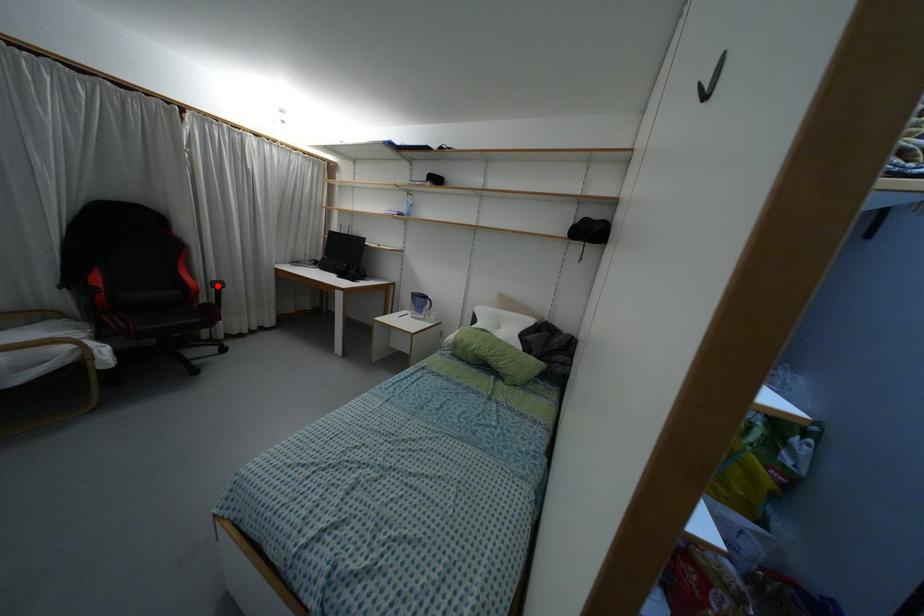
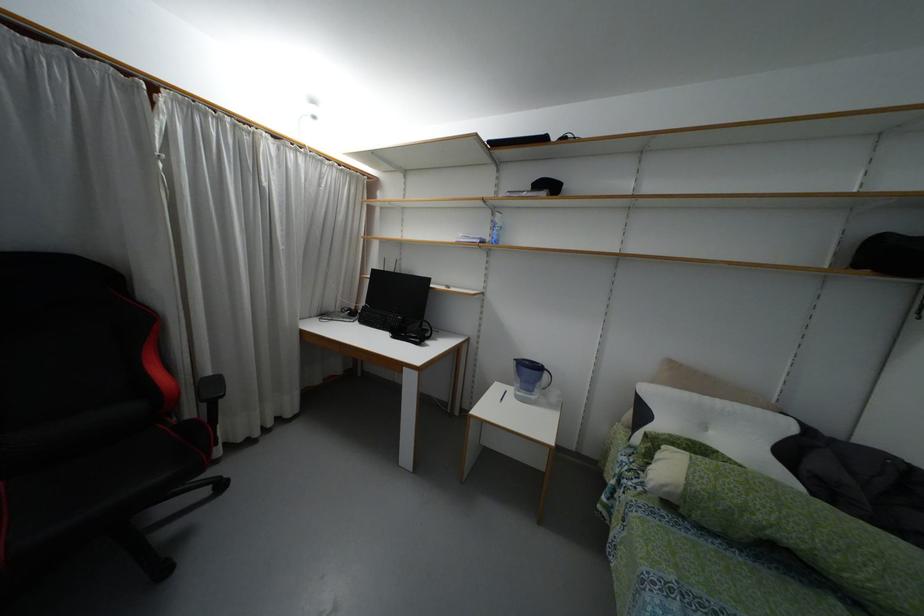
Where in the second image is the point corresponding to the highlighted location from the first image?

(213, 387)